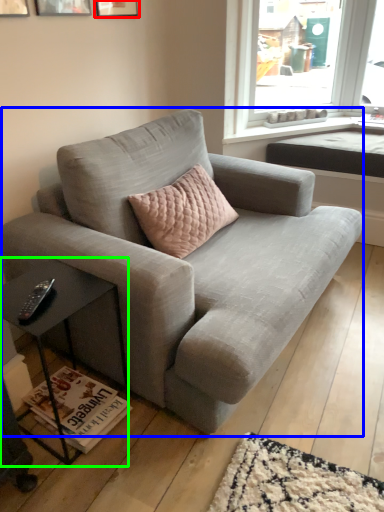
Question: Which is nearer to the picture frame (highlighted by a red box)? studio couch (highlighted by a blue box) or table (highlighted by a green box).

Choices:
 (A) studio couch
 (B) table

Answer: (A)